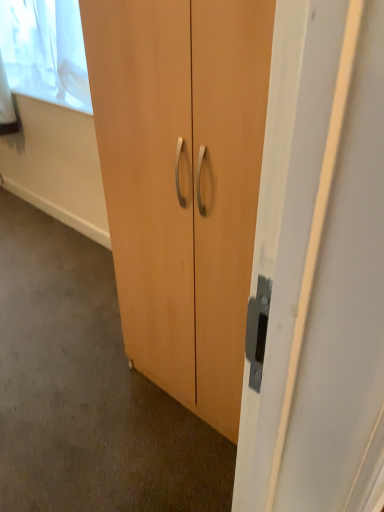
Where is `white sheer curtain at upper left`? white sheer curtain at upper left is located at coordinates (45, 51).

Looking at this image, measure the distance between point (19, 69) and camera.

A distance of 8.65 feet exists between point (19, 69) and camera.

The image size is (384, 512). In order to click on matte wood cupboard at center in this screenshot , I will do `click(182, 182)`.

What is the approximate width of matte wood cabinet at center?

matte wood cabinet at center is 2.98 meters in width.

I want to click on white sheer curtain at upper left, so click(45, 51).

Looking at the image, does matte wood cupboard at center seem bigger or smaller compared to matte wood cabinet at center?

Clearly, matte wood cupboard at center is larger in size than matte wood cabinet at center.

Between matte wood cupboard at center and matte wood cabinet at center, which one is positioned in front?

matte wood cupboard at center is more forward.

Choose the correct answer: Is white sheer curtain at upper left inside matte wood cabinet at center or outside it?

white sheer curtain at upper left is located beyond the bounds of matte wood cabinet at center.

Is point (62, 70) farther from viewer compared to point (167, 429)?

Yes.

Between white sheer curtain at upper left and matte wood cabinet at center, which one has smaller width?

white sheer curtain at upper left.

From a real-world perspective, which object rests below the other?

matte wood cabinet at center is physically lower.

Is matte wood cabinet at center next to matte wood cupboard at center?

Result: They are not placed beside each other.

From the image's perspective, does matte wood cabinet at center appear higher than matte wood cupboard at center?

Incorrect, from the image's perspective, matte wood cabinet at center is lower than matte wood cupboard at center.

Is matte wood cabinet at center turned away from matte wood cupboard at center?

No, matte wood cabinet at center's orientation is not away from matte wood cupboard at center.

How far apart are white sheer curtain at upper left and matte wood cupboard at center?

The distance of white sheer curtain at upper left from matte wood cupboard at center is 4.56 feet.

Which of these two, white sheer curtain at upper left or matte wood cupboard at center, is thinner?

Thinner between the two is white sheer curtain at upper left.

Considering the positions of objects white sheer curtain at upper left and matte wood cupboard at center in the image provided, who is in front, white sheer curtain at upper left or matte wood cupboard at center?

Positioned in front is matte wood cupboard at center.

Who is smaller, matte wood cupboard at center or white sheer curtain at upper left?

white sheer curtain at upper left is smaller.

Based on the photo, considering the relative positions of matte wood cupboard at center and white sheer curtain at upper left in the image provided, is matte wood cupboard at center to the left or to the right of white sheer curtain at upper left?

matte wood cupboard at center is to the right of white sheer curtain at upper left.

Which of these two, matte wood cupboard at center or white sheer curtain at upper left, is thinner?

Thinner between the two is white sheer curtain at upper left.

From a real-world perspective, is matte wood cabinet at center physically below white sheer curtain at upper left?

Yes, from a real-world perspective, matte wood cabinet at center is beneath white sheer curtain at upper left.

Which object is positioned more to the left, matte wood cabinet at center or white sheer curtain at upper left?

Positioned to the left is matte wood cabinet at center.

Is matte wood cabinet at center completely or partially outside of white sheer curtain at upper left?

Yes, matte wood cabinet at center is not within white sheer curtain at upper left.

This screenshot has width=384, height=512. I want to click on concrete located on the left of matte wood cupboard at center, so click(x=87, y=389).

Find the location of `window screen that is above the matte wood cabinet at center (from a real-world perspective)`. window screen that is above the matte wood cabinet at center (from a real-world perspective) is located at coordinates click(45, 51).

From the picture: Based on their spatial positions, is matte wood cupboard at center or white sheer curtain at upper left further from matte wood cabinet at center?

Based on the image, white sheer curtain at upper left appears to be further to matte wood cabinet at center.

From the image, which object appears to be farther from matte wood cabinet at center, white sheer curtain at upper left or matte wood cupboard at center?

Based on the image, white sheer curtain at upper left appears to be further to matte wood cabinet at center.

Considering their positions, is matte wood cabinet at center positioned closer to white sheer curtain at upper left than matte wood cupboard at center?

matte wood cabinet at center is closer to white sheer curtain at upper left.

When comparing their distances from white sheer curtain at upper left, does matte wood cupboard at center or matte wood cabinet at center seem closer?

Among the two, matte wood cabinet at center is located nearer to white sheer curtain at upper left.

Consider the image. When comparing their distances from matte wood cupboard at center, does matte wood cabinet at center or white sheer curtain at upper left seem closer?

Among the two, matte wood cabinet at center is located nearer to matte wood cupboard at center.

In the scene shown: Which object lies nearer to the anchor point matte wood cupboard at center, white sheer curtain at upper left or matte wood cabinet at center?

Among the two, matte wood cabinet at center is located nearer to matte wood cupboard at center.

The height and width of the screenshot is (512, 384). I want to click on cupboard that lies between white sheer curtain at upper left and matte wood cabinet at center from top to bottom, so click(x=182, y=182).